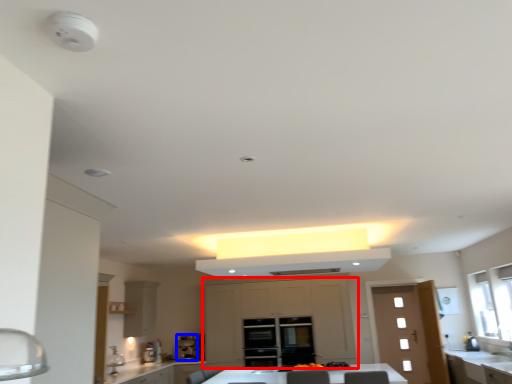
Question: Which of the following is the farthest to the observer, cabinetry (highlighted by a red box) or coffee machine (highlighted by a blue box)?

Choices:
 (A) cabinetry
 (B) coffee machine

Answer: (B)